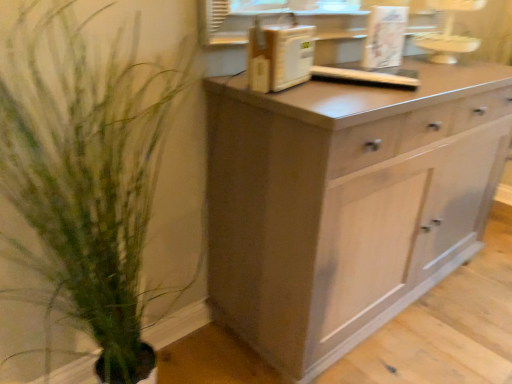
Question: Does matte gray cabinet at center have a greater width compared to white plastic microwave at upper center?

Choices:
 (A) no
 (B) yes

Answer: (B)

Question: Is matte gray cabinet at center facing towards white plastic microwave at upper center?

Choices:
 (A) no
 (B) yes

Answer: (A)

Question: Is the depth of matte gray cabinet at center less than that of white plastic microwave at upper center?

Choices:
 (A) yes
 (B) no

Answer: (A)

Question: From a real-world perspective, is matte gray cabinet at center located higher than white plastic microwave at upper center?

Choices:
 (A) yes
 (B) no

Answer: (B)

Question: Is matte gray cabinet at center to the right of white plastic microwave at upper center from the viewer's perspective?

Choices:
 (A) no
 (B) yes

Answer: (B)

Question: Considering the positions of point (466, 160) and point (248, 34), is point (466, 160) closer or farther from the camera than point (248, 34)?

Choices:
 (A) farther
 (B) closer

Answer: (A)

Question: In the image, is matte gray cabinet at center on the left side or the right side of white plastic microwave at upper center?

Choices:
 (A) right
 (B) left

Answer: (A)

Question: Is matte gray cabinet at center taller or shorter than white plastic microwave at upper center?

Choices:
 (A) tall
 (B) short

Answer: (A)

Question: Relative to white plastic microwave at upper center, is matte gray cabinet at center in front or behind?

Choices:
 (A) behind
 (B) front

Answer: (B)

Question: In terms of size, does green leafy plant at left appear bigger or smaller than white plastic microwave at upper center?

Choices:
 (A) small
 (B) big

Answer: (B)

Question: From the image's perspective, is green leafy plant at left located above or below white plastic microwave at upper center?

Choices:
 (A) above
 (B) below

Answer: (B)

Question: From a real-world perspective, is green leafy plant at left positioned above or below white plastic microwave at upper center?

Choices:
 (A) above
 (B) below

Answer: (B)

Question: Is green leafy plant at left inside the boundaries of white plastic microwave at upper center, or outside?

Choices:
 (A) inside
 (B) outside

Answer: (B)

Question: Does point (264, 82) appear closer or farther from the camera than point (51, 180)?

Choices:
 (A) farther
 (B) closer

Answer: (A)

Question: In terms of width, does white plastic microwave at upper center look wider or thinner when compared to green leafy plant at left?

Choices:
 (A) wide
 (B) thin

Answer: (B)